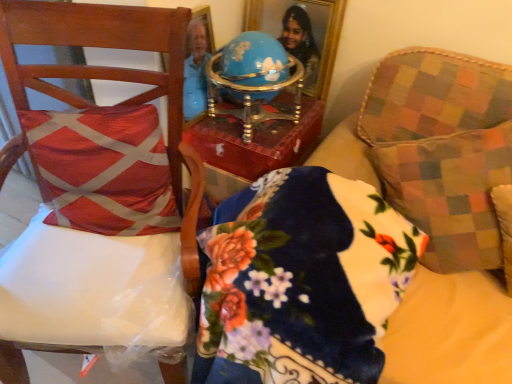
Question: From a real-world perspective, is floral velvet pillow at center physically located above or below wooden chair at left?

Choices:
 (A) above
 (B) below

Answer: (B)

Question: Does point (278, 178) appear closer or farther from the camera than point (138, 31)?

Choices:
 (A) farther
 (B) closer

Answer: (A)

Question: Estimate the real-world distances between objects in this image. Which object is closer to the wooden chair at left?

Choices:
 (A) multicolored checkered throw pillow at right, which appears as the first throw pillow when viewed from the right
 (B) red textured cushion at left, which is counted as the second throw pillow, starting from the right
 (C) floral velvet pillow at center
 (D) wooden chair at left
 (E) gold-framed mirror at upper center

Answer: (C)

Question: Estimate the real-world distances between objects in this image. Which object is farther from the wooden chair at left?

Choices:
 (A) multicolored checkered throw pillow at right, which appears as the first throw pillow when viewed from the right
 (B) wooden chair at left
 (C) floral velvet pillow at center
 (D) gold-framed mirror at upper center
 (E) red textured cushion at left, the first throw pillow positioned from the left

Answer: (D)